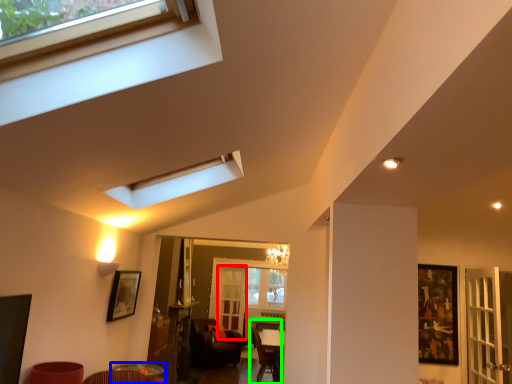
Question: Which is nearer to the screen door (highlighted by a red box)? table (highlighted by a blue box) or armchair (highlighted by a green box).

Choices:
 (A) table
 (B) armchair

Answer: (B)